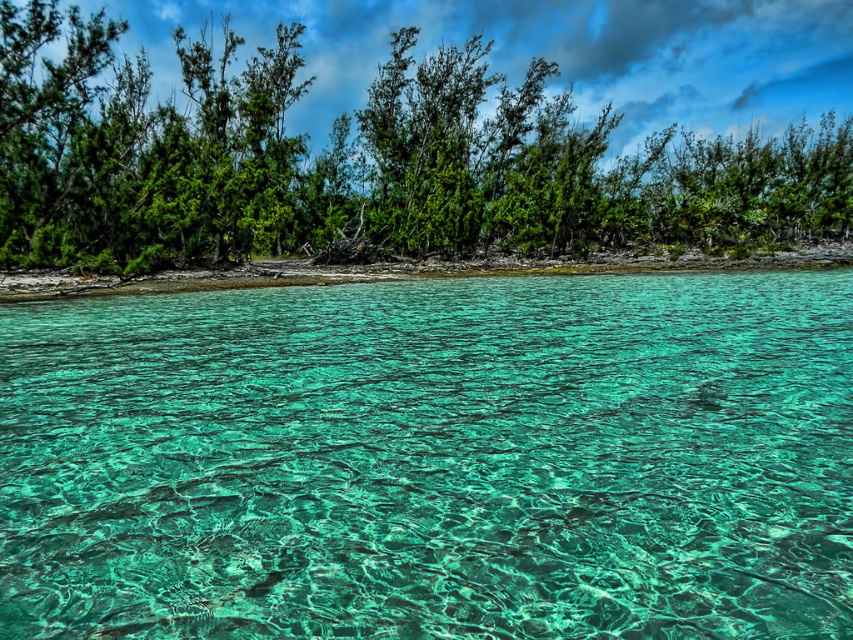
Question: In this image, where is translucent teal water at center located relative to green leafy trees at upper center?

Choices:
 (A) left
 (B) right

Answer: (A)

Question: Which point is farther to the camera?

Choices:
 (A) translucent teal water at center
 (B) green leafy trees at upper center

Answer: (B)

Question: Can you confirm if translucent teal water at center is wider than green leafy trees at upper center?

Choices:
 (A) no
 (B) yes

Answer: (A)

Question: Is translucent teal water at center to the left of green leafy trees at upper center from the viewer's perspective?

Choices:
 (A) yes
 (B) no

Answer: (A)

Question: Which of the following is the farthest from the observer?

Choices:
 (A) green leafy trees at upper center
 (B) translucent teal water at center

Answer: (A)